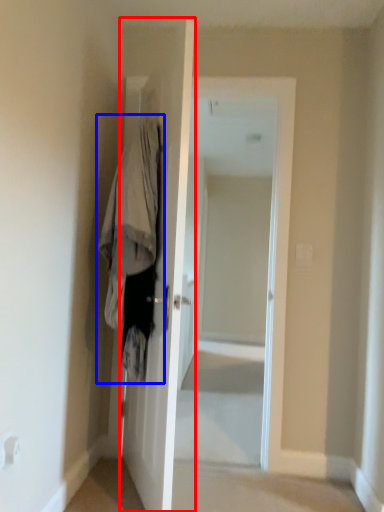
Question: Which point is further to the camera, door (highlighted by a red box) or clothing (highlighted by a blue box)?

Choices:
 (A) door
 (B) clothing

Answer: (B)